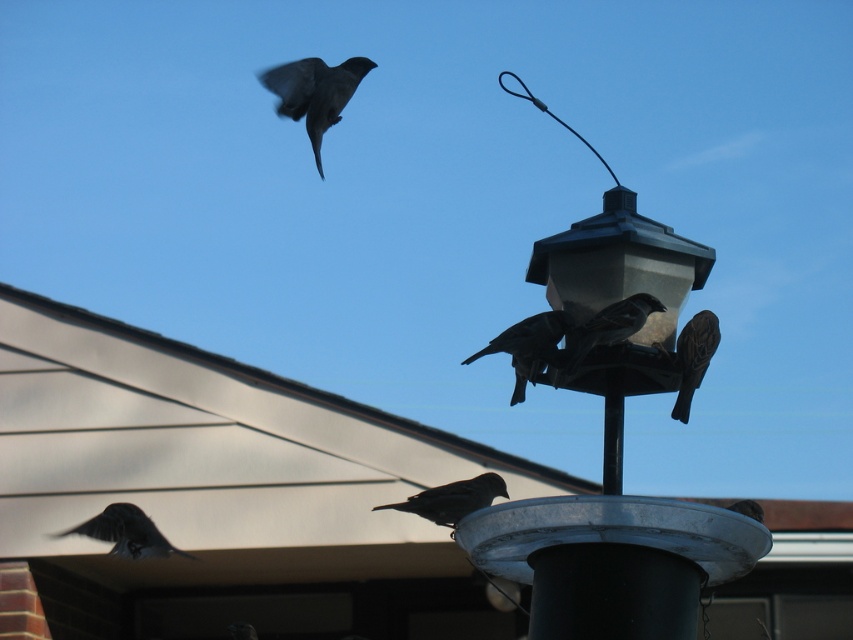
You are a birdwatcher observing the birds in the scene. You notice two birds with distinct feather colors. Which bird with dark brown feathers at center is positioned to the right of the dark gray feathers at lower left?

The dark brown feathers at center are positioned to the right of the dark gray feathers at lower left.

You are standing in front of a building and see the metallic gray bird feeder at center. If you want to locate it precisely on a grid where the bottom left corner is the origin point, what are its coordinates?

The metallic gray bird feeder at center is located at coordinates 0.878 on the x axis and 0.719 on the y axis.

You are a bird trying to land on the metallic gray bird feeder at center. The black matte pole at center is nearby. Which object is bigger and would give you a better landing spot?

The metallic gray bird feeder at center is larger in size compared to the black matte pole at center, so it would provide a better landing spot for the bird.